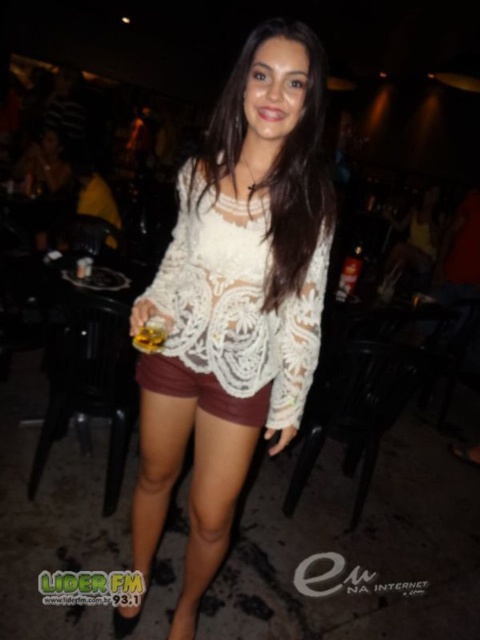
Describe the element at coordinates (276, 161) in the screenshot. The height and width of the screenshot is (640, 480). I see `white lace blouse at center` at that location.

Based on the photo, between white lace blouse at center and clear plastic bottle at center, which one has less height?

clear plastic bottle at center

Is point (237, 88) positioned before point (336, 296)?

Yes, point (237, 88) is in front of point (336, 296).

The height and width of the screenshot is (640, 480). Identify the location of white lace blouse at center. (276, 161).

Is matte lace shorts at center smaller than clear plastic bottle at center?

Indeed, matte lace shorts at center has a smaller size compared to clear plastic bottle at center.

Is point (253, 426) more distant than point (360, 248)?

No, it is in front of (360, 248).

You are a GUI agent. You are given a task and a screenshot of the screen. Output one action in this format:
    pyautogui.click(x=<x>, y=<y>)
    Task: Click on the matte lace shorts at center
    This screenshot has width=480, height=640.
    Given the screenshot: What is the action you would take?
    pyautogui.click(x=201, y=388)

Can you confirm if white lace top at center is positioned to the right of white lace blouse at center?

In fact, white lace top at center is to the left of white lace blouse at center.

Is the position of white lace top at center less distant than that of white lace blouse at center?

Yes, white lace top at center is closer to the viewer.

Which is behind, point (254, 403) or point (292, 205)?

The point (254, 403) is more distant.

In order to click on white lace top at center in this screenshot , I will do `click(236, 300)`.